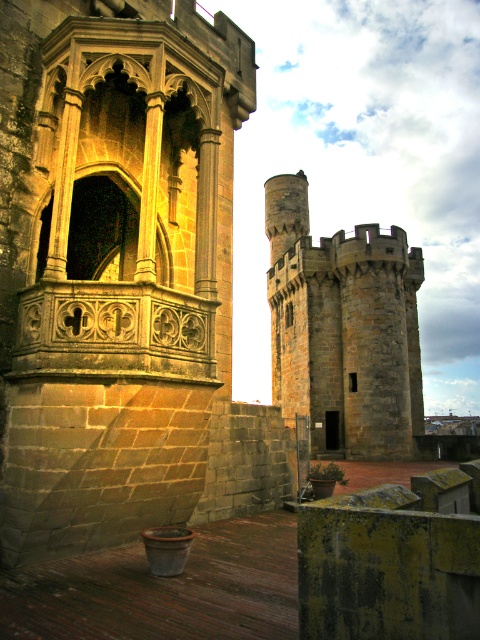
Question: Among these points, which one is farthest from the camera?

Choices:
 (A) (299, 266)
 (B) (71, 112)

Answer: (A)

Question: Does stone carved balcony at center have a smaller size compared to stone tower at center?

Choices:
 (A) no
 (B) yes

Answer: (B)

Question: Which of the following is the closest to the observer?

Choices:
 (A) pyautogui.click(x=286, y=330)
 (B) pyautogui.click(x=24, y=268)

Answer: (B)

Question: Does stone carved balcony at center appear on the right side of stone tower at center?

Choices:
 (A) yes
 (B) no

Answer: (B)

Question: From the image, what is the correct spatial relationship of stone carved balcony at center in relation to stone tower at center?

Choices:
 (A) left
 (B) right

Answer: (A)